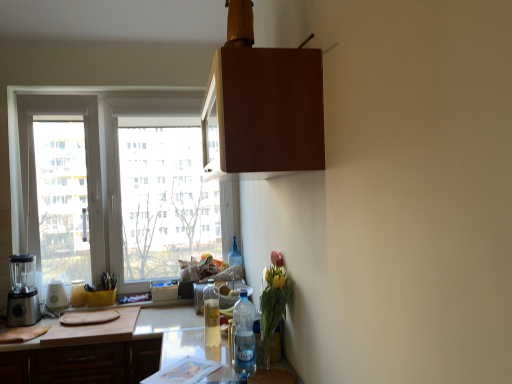
The width and height of the screenshot is (512, 384). What do you see at coordinates (56, 296) in the screenshot?
I see `white plastic toaster at left, which ranks as the 2th appliance in left-to-right order` at bounding box center [56, 296].

Where is `translucent plastic bottle at center, placed as the second bottle when sorted from right to left`? translucent plastic bottle at center, placed as the second bottle when sorted from right to left is located at coordinates (234, 255).

Image resolution: width=512 pixels, height=384 pixels. Identify the location of translucent glass bottle at lower left, the third bottle when ordered from front to back. (78, 293).

The height and width of the screenshot is (384, 512). Describe the element at coordinates (264, 111) in the screenshot. I see `brown matte cabinet at upper center, placed as the first cabinetry when sorted from top to bottom` at that location.

Consider the image. In order to face brown matte cabinet at upper center, which appears as the first cabinetry when viewed from the front, should I rotate leftwards or rightwards?

Rotate left and turn 1.243 degrees.

Describe the element at coordinates (244, 337) in the screenshot. The height and width of the screenshot is (384, 512). I see `clear plastic bottle at lower center, which is the 4th bottle in left-to-right order` at that location.

This screenshot has height=384, width=512. What are the coordinates of `white plastic toaster at left, which ranks as the 2th appliance in left-to-right order` in the screenshot? It's located at (56, 296).

Can you confirm if satin silver blender at left, positioned as the 1th appliance in left-to-right order, is taller than translucent plastic bottle at center, arranged as the 3th bottle when viewed from the left?

Yes, satin silver blender at left, positioned as the 1th appliance in left-to-right order, is taller than translucent plastic bottle at center, arranged as the 3th bottle when viewed from the left.

Which of these two, satin silver blender at left, the third appliance viewed from the right, or translucent plastic bottle at center, the 1th bottle from the back, is bigger?

Bigger between the two is satin silver blender at left, the third appliance viewed from the right.

Considering the relative positions of satin silver blender at left, the third appliance viewed from the right, and translucent plastic bottle at center, the 1th bottle from the back, in the image provided, is satin silver blender at left, the third appliance viewed from the right, to the left of translucent plastic bottle at center, the 1th bottle from the back, from the viewer's perspective?

Yes, satin silver blender at left, the third appliance viewed from the right, is to the left of translucent plastic bottle at center, the 1th bottle from the back.

Is satin silver blender at left, the third appliance viewed from the right, positioned beyond the bounds of translucent plastic bottle at center, arranged as the 3th bottle when viewed from the left?

Yes, satin silver blender at left, the third appliance viewed from the right, is located beyond the bounds of translucent plastic bottle at center, arranged as the 3th bottle when viewed from the left.

Which is nearer, (208,293) or (253,340)?

Clearly, point (208,293) is more distant from the camera than point (253,340).

Could you tell me if clear glass bottle at center, which is the 3th bottle in right-to-left order, is turned towards clear plastic bottle at lower center, the 1th bottle from the right?

No, clear glass bottle at center, which is the 3th bottle in right-to-left order, does not turn towards clear plastic bottle at lower center, the 1th bottle from the right.

Is the position of clear plastic bottle at center, which ranks as the third appliance in left-to-right order, less distant than that of translucent plastic bottle at center, placed as the second bottle when sorted from right to left?

Yes, it is.

From a real-world perspective, which object stands above the other?

translucent plastic bottle at center, placed as the second bottle when sorted from right to left, from a real-world perspective.

Consider the image. Which object is positioned more to the right, clear plastic bottle at center, which appears as the 1th appliance when viewed from the right, or translucent plastic bottle at center, arranged as the 3th bottle when viewed from the left?

Positioned to the right is translucent plastic bottle at center, arranged as the 3th bottle when viewed from the left.

Can you confirm if clear plastic bottle at center, which appears as the 1th appliance when viewed from the right, is thinner than translucent plastic bottle at center, which is counted as the fourth bottle, starting from the front?

No.

From a real-world perspective, does satin silver blender at left, positioned as the 1th appliance in left-to-right order, sit lower than translucent glass bottle at lower left, positioned as the second bottle in back-to-front order?

Actually, satin silver blender at left, positioned as the 1th appliance in left-to-right order, is physically above translucent glass bottle at lower left, positioned as the second bottle in back-to-front order, in the real world.

Considering the sizes of objects satin silver blender at left, the third appliance viewed from the right, and translucent glass bottle at lower left, positioned as the 1th bottle in left-to-right order, in the image provided, who is taller, satin silver blender at left, the third appliance viewed from the right, or translucent glass bottle at lower left, positioned as the 1th bottle in left-to-right order,?

With more height is satin silver blender at left, the third appliance viewed from the right.

Is satin silver blender at left, the third appliance viewed from the right, at the left side of translucent glass bottle at lower left, acting as the 4th bottle starting from the right?

Yes, satin silver blender at left, the third appliance viewed from the right, is to the left of translucent glass bottle at lower left, acting as the 4th bottle starting from the right.

From the image's perspective, is satin silver blender at left, the third appliance viewed from the right, positioned above or below translucent glass bottle at lower left, the third bottle when ordered from front to back?

From the image's perspective, satin silver blender at left, the third appliance viewed from the right, appears above translucent glass bottle at lower left, the third bottle when ordered from front to back.

How distant is brown matte cabinet at upper center, which appears as the first cabinetry when viewed from the front, from translucent glass bottle at lower left, acting as the 4th bottle starting from the right?

brown matte cabinet at upper center, which appears as the first cabinetry when viewed from the front, is 6.50 feet away from translucent glass bottle at lower left, acting as the 4th bottle starting from the right.

Consider the image. Which object is positioned more to the left, brown matte cabinet at upper center, which appears as the first cabinetry when viewed from the front, or translucent glass bottle at lower left, acting as the 4th bottle starting from the right?

translucent glass bottle at lower left, acting as the 4th bottle starting from the right, is more to the left.

How many degrees apart are the facing directions of brown matte cabinet at upper center, which appears as the first cabinetry when viewed from the front, and translucent glass bottle at lower left, the third bottle when ordered from front to back?

The angle between the facing direction of brown matte cabinet at upper center, which appears as the first cabinetry when viewed from the front, and the facing direction of translucent glass bottle at lower left, the third bottle when ordered from front to back, is 90 degrees.

Is point (234, 162) closer or farther from the camera than point (70, 298)?

Point (234, 162) is closer to the camera than point (70, 298).

From the image's perspective, which one is positioned higher, satin silver blender at left, positioned as the 1th appliance in left-to-right order, or white plastic toaster at left, marked as the 2th appliance in a right-to-left arrangement?

satin silver blender at left, positioned as the 1th appliance in left-to-right order, from the image's perspective.

From the image's perspective, count 2nd appliances downward from the satin silver blender at left, the third appliance viewed from the right, and point to it. Please provide its 2D coordinates.

[(56, 296)]

Is satin silver blender at left, the third appliance viewed from the right, not close to white plastic toaster at left, marked as the 2th appliance in a right-to-left arrangement?

No, satin silver blender at left, the third appliance viewed from the right, is in close proximity to white plastic toaster at left, marked as the 2th appliance in a right-to-left arrangement.

Would you say satin silver blender at left, positioned as the 1th appliance in left-to-right order, is outside white plastic toaster at left, marked as the 2th appliance in a right-to-left arrangement?

Yes, satin silver blender at left, positioned as the 1th appliance in left-to-right order, is located beyond the bounds of white plastic toaster at left, marked as the 2th appliance in a right-to-left arrangement.

How much distance is there between clear plastic bottle at lower center, which is the 4th bottle in left-to-right order, and clear plastic bottle at center, which ranks as the third appliance in left-to-right order?

clear plastic bottle at lower center, which is the 4th bottle in left-to-right order, is 20.67 inches from clear plastic bottle at center, which ranks as the third appliance in left-to-right order.

Does point (253, 351) come farther from viewer compared to point (231, 304)?

No, (253, 351) is in front of (231, 304).

Is clear plastic bottle at lower center, the 1th bottle from the right, positioned in front of clear plastic bottle at center, which ranks as the third appliance in left-to-right order?

Yes, clear plastic bottle at lower center, the 1th bottle from the right, is in front of clear plastic bottle at center, which ranks as the third appliance in left-to-right order.

Considering the sizes of objects clear plastic bottle at lower center, the 4th bottle in the back-to-front sequence, and clear plastic bottle at center, which ranks as the third appliance in left-to-right order, in the image provided, who is smaller, clear plastic bottle at lower center, the 4th bottle in the back-to-front sequence, or clear plastic bottle at center, which ranks as the third appliance in left-to-right order,?

clear plastic bottle at lower center, the 4th bottle in the back-to-front sequence, is smaller.

You are a GUI agent. You are given a task and a screenshot of the screen. Output one action in this format:
    pyautogui.click(x=<x>, y=<y>)
    Task: Click on the bottle positioned vertically above the satin silver blender at left, positioned as the 1th appliance in left-to-right order (from a real-world perspective)
    
    Given the screenshot: What is the action you would take?
    pyautogui.click(x=234, y=255)

Where is `the 1st bottle below the clear plastic bottle at lower center, the 4th bottle in the back-to-front sequence (from a real-world perspective)`? Image resolution: width=512 pixels, height=384 pixels. the 1st bottle below the clear plastic bottle at lower center, the 4th bottle in the back-to-front sequence (from a real-world perspective) is located at coordinates (211, 315).

Looking at the image, which one is located further to clear glass bottle at center, marked as the second bottle in a front-to-back arrangement, clear plastic bottle at lower center, which is the 4th bottle in left-to-right order, or wooden cutting board at lower left, the first cabinetry from the back?

wooden cutting board at lower left, the first cabinetry from the back, is further to clear glass bottle at center, marked as the second bottle in a front-to-back arrangement.

When comparing their distances from wooden cutting board at lower left, the first cabinetry from the back, does white plastic toaster at left, marked as the 2th appliance in a right-to-left arrangement, or brown matte cabinet at upper center, the second cabinetry from the back, seem closer?

The object closer to wooden cutting board at lower left, the first cabinetry from the back, is white plastic toaster at left, marked as the 2th appliance in a right-to-left arrangement.

Based on the photo, from the image, which object appears to be nearer to clear glass bottle at center, arranged as the third bottle when viewed from the back, satin silver blender at left, the third appliance viewed from the right, or translucent glass bottle at lower left, acting as the 4th bottle starting from the right?

translucent glass bottle at lower left, acting as the 4th bottle starting from the right.

Which object lies nearer to the anchor point satin silver blender at left, the third appliance viewed from the right, clear glass bottle at center, which is the 3th bottle in right-to-left order, or translucent plastic bottle at center, arranged as the 3th bottle when viewed from the left?

Among the two, clear glass bottle at center, which is the 3th bottle in right-to-left order, is located nearer to satin silver blender at left, the third appliance viewed from the right.

Consider the image. Estimate the real-world distances between objects in this image. Which object is further from translucent glass bottle at lower left, acting as the 4th bottle starting from the right, brown matte cabinet at upper center, the 2th cabinetry viewed from the left, or clear plastic bottle at lower center, the 4th bottle in the back-to-front sequence?

brown matte cabinet at upper center, the 2th cabinetry viewed from the left, lies further to translucent glass bottle at lower left, acting as the 4th bottle starting from the right, than the other object.

Estimate the real-world distances between objects in this image. Which object is further from clear glass bottle at center, marked as the second bottle in a front-to-back arrangement, clear plastic bottle at lower center, the 4th bottle in the back-to-front sequence, or satin silver blender at left, positioned as the 1th appliance in left-to-right order?

satin silver blender at left, positioned as the 1th appliance in left-to-right order.

Which object lies further to the anchor point satin silver blender at left, positioned as the 1th appliance in left-to-right order, translucent glass bottle at lower left, positioned as the 1th bottle in left-to-right order, or wooden cutting board at lower left, marked as the second cabinetry in a front-to-back arrangement?

wooden cutting board at lower left, marked as the second cabinetry in a front-to-back arrangement, lies further to satin silver blender at left, positioned as the 1th appliance in left-to-right order, than the other object.

Estimate the real-world distances between objects in this image. Which object is further from clear plastic bottle at center, which appears as the 1th appliance when viewed from the right, wooden cutting board at lower left, placed as the 1th cabinetry when sorted from bottom to top, or clear plastic bottle at lower center, which is the first bottle in front-to-back order?

The object further to clear plastic bottle at center, which appears as the 1th appliance when viewed from the right, is wooden cutting board at lower left, placed as the 1th cabinetry when sorted from bottom to top.

Identify the location of appliance situated between white plastic toaster at left, which ranks as the 2th appliance in left-to-right order, and clear glass bottle at center, the 2th bottle positioned from the left, from left to right. The height and width of the screenshot is (384, 512). 199,297.

The width and height of the screenshot is (512, 384). Identify the location of appliance between translucent glass bottle at lower left, positioned as the second bottle in back-to-front order, and clear glass bottle at center, the 2th bottle positioned from the left. (199, 297).

I want to click on cabinetry located between translucent glass bottle at lower left, positioned as the second bottle in back-to-front order, and clear plastic bottle at lower center, the 1th bottle from the right, in the left-right direction, so click(x=84, y=363).

Where is `cabinetry between satin silver blender at left, the third appliance viewed from the right, and clear plastic bottle at center, which ranks as the third appliance in left-to-right order, in the horizontal direction`? The width and height of the screenshot is (512, 384). cabinetry between satin silver blender at left, the third appliance viewed from the right, and clear plastic bottle at center, which ranks as the third appliance in left-to-right order, in the horizontal direction is located at coordinates (84, 363).